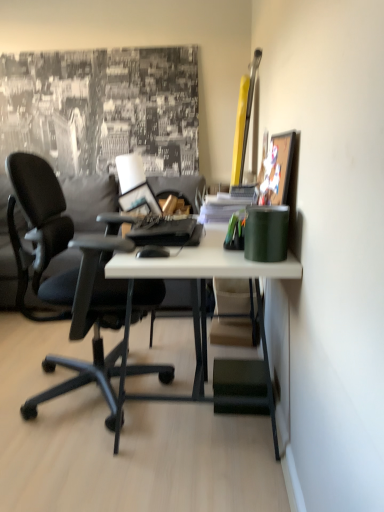
Where is `free space behind black matte mouse at center`? free space behind black matte mouse at center is located at coordinates (162, 246).